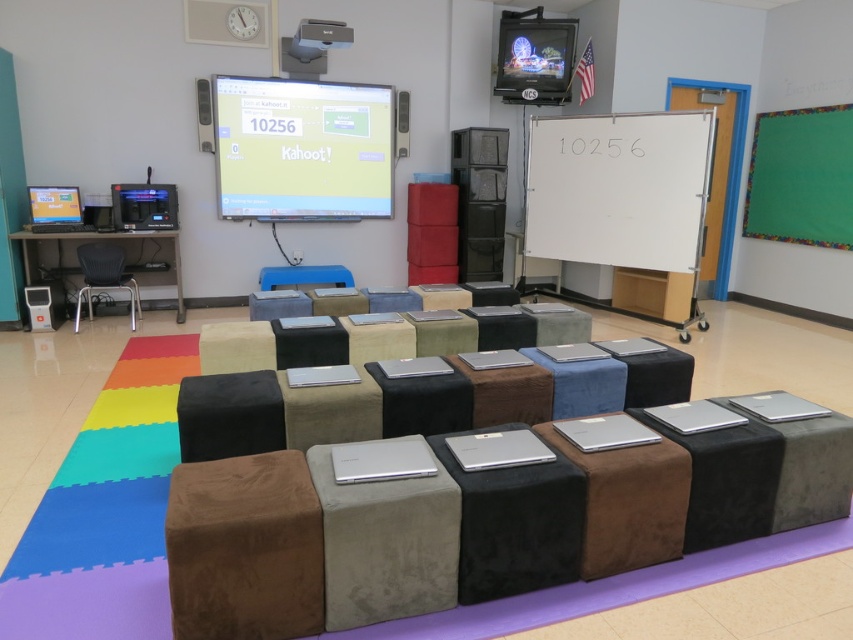
Which of these two, white matte whiteboard at center or matte plastic projector screen at upper center, stands shorter?

matte plastic projector screen at upper center is shorter.

Between white matte whiteboard at center and matte plastic projector screen at upper center, which one is positioned higher?

matte plastic projector screen at upper center is higher up.

You are a GUI agent. You are given a task and a screenshot of the screen. Output one action in this format:
    pyautogui.click(x=<x>, y=<y>)
    Task: Click on the white matte whiteboard at center
    The width and height of the screenshot is (853, 640).
    Given the screenshot: What is the action you would take?
    pyautogui.click(x=619, y=188)

At what (x,y) coordinates should I click in order to perform the action: click on white matte whiteboard at center. Please return your answer as a coordinate pair (x, y). The width and height of the screenshot is (853, 640). Looking at the image, I should click on (619, 188).

Which is more to the left, brown suede stool at lower left or green felt board at upper right?

brown suede stool at lower left is more to the left.

Consider the image. Is brown suede stool at lower left to the right of green felt board at upper right from the viewer's perspective?

In fact, brown suede stool at lower left is to the left of green felt board at upper right.

The image size is (853, 640). Find the location of `brown suede stool at lower left`. brown suede stool at lower left is located at coordinates (244, 548).

Describe the element at coordinates (244, 548) in the screenshot. I see `brown suede stool at lower left` at that location.

Does brown suede stool at lower left have a lesser width compared to matte black projector at upper center?

Correct, brown suede stool at lower left's width is less than matte black projector at upper center's.

This screenshot has width=853, height=640. What do you see at coordinates (244, 548) in the screenshot? I see `brown suede stool at lower left` at bounding box center [244, 548].

Where is `brown suede stool at lower left`? brown suede stool at lower left is located at coordinates (244, 548).